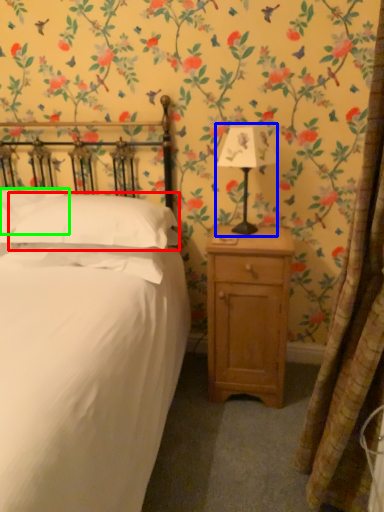
Question: Which is farther away from pillow (highlighted by a red box)? bedside lamp (highlighted by a blue box) or pillow (highlighted by a green box)?

Choices:
 (A) bedside lamp
 (B) pillow

Answer: (A)